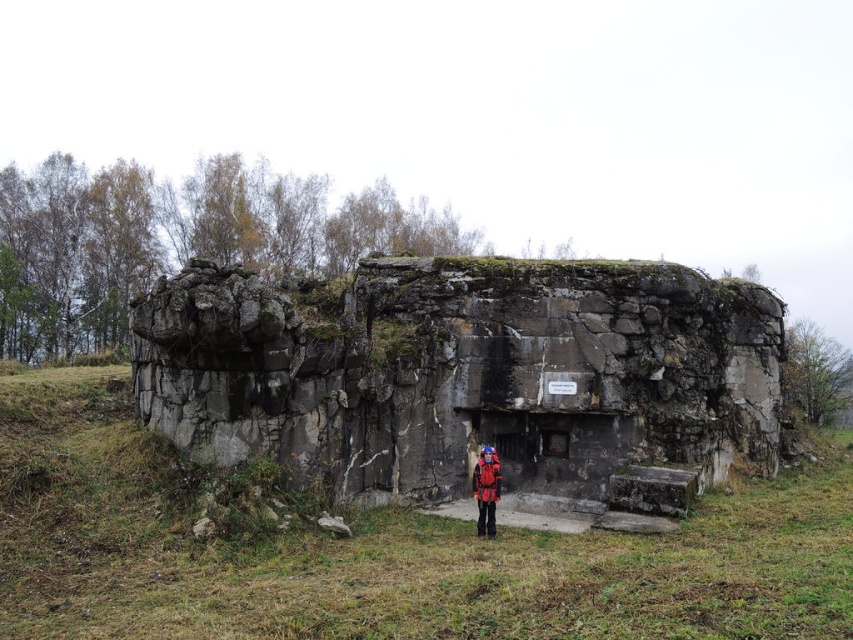
You are standing at the entrance of the old stone bunker and notice two points marked on the structure. The first point is at coordinates point (370, 422) and the second at point (491, 451). Which point is closer to you?

Point (491, 451) is closer to you because it is less further to the camera than point (370, 422).

You are a hiker standing in an open field with a rusty stone bunker at center in front of you. You want to take a photo of the bunker but need to be at least 10 meters away to capture the entire structure. Are you within the required distance?

The distance of rusty stone bunker at center from viewer is 11.63 meters, so yes, you are within the required distance to capture the entire structure as you are 1.63 meters beyond the minimum 10 meters requirement.

You are navigating a GPS system and need to locate the rusty stone bunker at center. What are the coordinates where you can find it?

The rusty stone bunker at center can be found at coordinates point (467, 374).